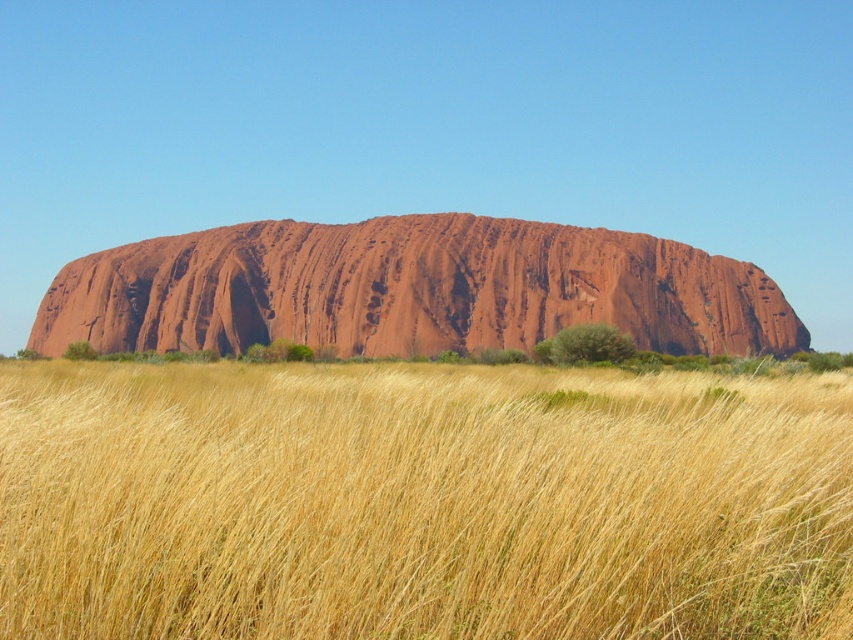
Question: Considering the relative positions of yellow grass at center and rustic sandstone rock formation at center in the image provided, where is yellow grass at center located with respect to rustic sandstone rock formation at center?

Choices:
 (A) above
 (B) below

Answer: (B)

Question: Can you confirm if yellow grass at center is thinner than rustic sandstone rock formation at center?

Choices:
 (A) no
 (B) yes

Answer: (B)

Question: Is yellow grass at center thinner than rustic sandstone rock formation at center?

Choices:
 (A) no
 (B) yes

Answer: (B)

Question: Which point is farther from the camera taking this photo?

Choices:
 (A) (488, 541)
 (B) (190, 272)

Answer: (B)